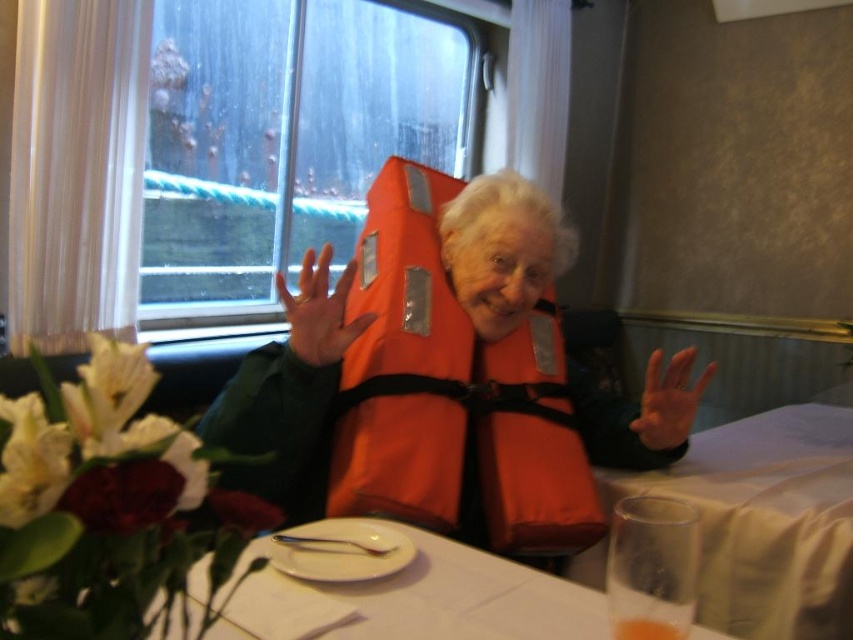
Based on the photo, you are a passenger on a ship and want to enjoy the view outside through the transparent glass window at upper left while eating from the white paper plate at center. Can you see the window clearly from where the plate is placed?

The transparent glass window at upper left is taller than the white paper plate at center, so yes, you can see the window clearly from where the plate is placed.

You are a server in a ship dining area. You need to place a new menu on the table between the white paper plate at center and the orange matte life vest at center. Which object should you place the menu closer to so it doesn t fall off the table?

You should place the menu closer to the orange matte life vest at center because the white paper plate at center has a lesser height and is shorter, making the life vest a more stable base to prevent the menu from slipping off.

You are a waiter in a ship dining area. You need to place a dessert on the white paper plate at center and then put the orange matte life vest at center on the floor next to the table. Which item will require more horizontal space on the table?

The white paper plate at center requires more horizontal space on the table because its width surpasses that of the orange matte life vest at center.